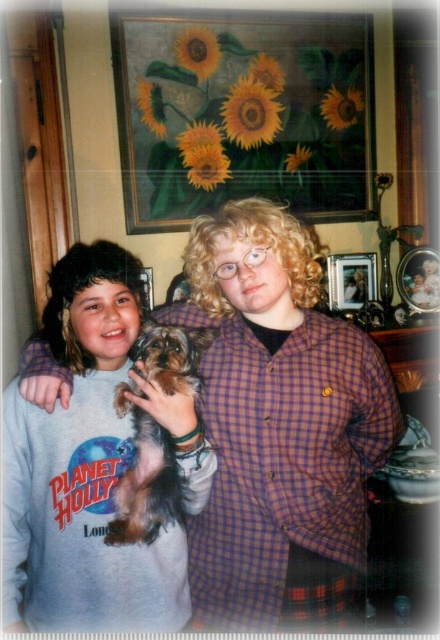
Question: Is light gray sweatshirt at center above fuzzy brown dog at center?

Choices:
 (A) no
 (B) yes

Answer: (A)

Question: Which object is farther from the camera taking this photo?

Choices:
 (A) light gray sweatshirt at center
 (B) plaid shirt at center
 (C) fuzzy brown dog at center

Answer: (B)

Question: Does light gray sweatshirt at center appear over fuzzy brown dog at center?

Choices:
 (A) yes
 (B) no

Answer: (B)

Question: Which object is positioned farthest from the fuzzy brown dog at center?

Choices:
 (A) light gray sweatshirt at center
 (B) plaid shirt at center

Answer: (B)

Question: Is plaid shirt at center bigger than fuzzy brown dog at center?

Choices:
 (A) yes
 (B) no

Answer: (A)

Question: Estimate the real-world distances between objects in this image. Which object is closer to the light gray sweatshirt at center?

Choices:
 (A) plaid shirt at center
 (B) fuzzy brown dog at center

Answer: (B)